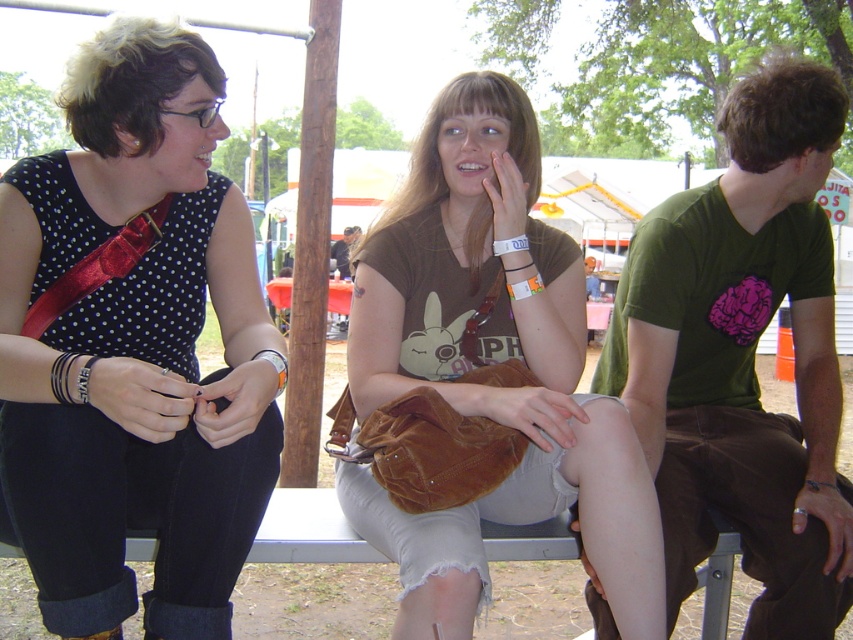
You are an observer looking at the scene. There are two points marked in the image, point (119, 456) and point (456, 204). Which of these two points is nearer to you?

Point (119, 456) is closer to the viewer than point (456, 204).

You are at an outdoor event and see two people sitting in front of you. One is wearing a matte black dress at left and the other a green cotton shirt at right. Which person is sitting closer to the ground?

The matte black dress at left is positioned under the green cotton shirt at right, so the person in the matte black dress at left is sitting closer to the ground.